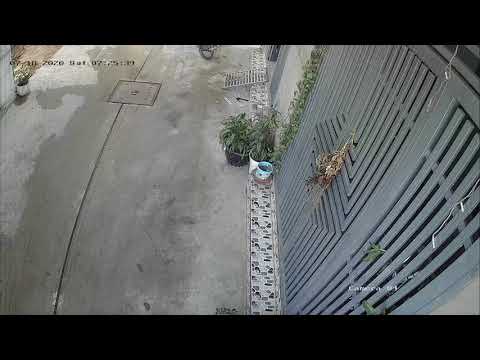
You are a GUI agent. You are given a task and a screenshot of the screen. Output one action in this format:
    pyautogui.click(x=<x>, y=<y>)
    Task: Click on the green plant
    Image resolution: width=480 pixels, height=360 pixels.
    Given the screenshot: What is the action you would take?
    pos(240,131), pos(23,75), pos(296,116)